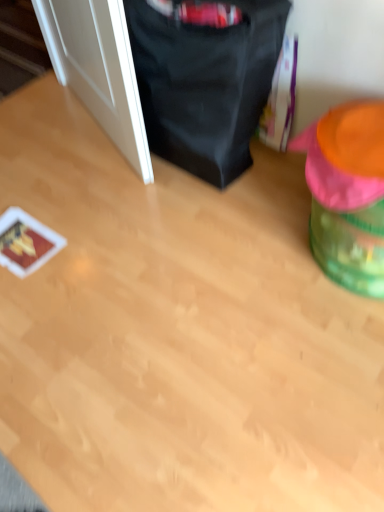
Question: From a real-world perspective, is white glossy door at left positioned above or below black fabric bean bag chair at upper center, placed as the 1th bean bag chair when sorted from left to right?

Choices:
 (A) above
 (B) below

Answer: (A)

Question: Considering the positions of white glossy door at left and black fabric bean bag chair at upper center, placed as the 1th bean bag chair when sorted from left to right, in the image, is white glossy door at left wider or thinner than black fabric bean bag chair at upper center, placed as the 1th bean bag chair when sorted from left to right,?

Choices:
 (A) thin
 (B) wide

Answer: (A)

Question: Estimate the real-world distances between objects in this image. Which object is closer to the black fabric bean bag chair at upper center, placed as the 1th bean bag chair when sorted from left to right?

Choices:
 (A) white glossy door at left
 (B) green plastic bean bag chair at right, which is counted as the first bean bag chair, starting from the right

Answer: (A)

Question: Considering the real-world distances, which object is closest to the white glossy door at left?

Choices:
 (A) green plastic bean bag chair at right, which is counted as the first bean bag chair, starting from the right
 (B) black fabric bean bag chair at upper center, placed as the 1th bean bag chair when sorted from left to right

Answer: (B)